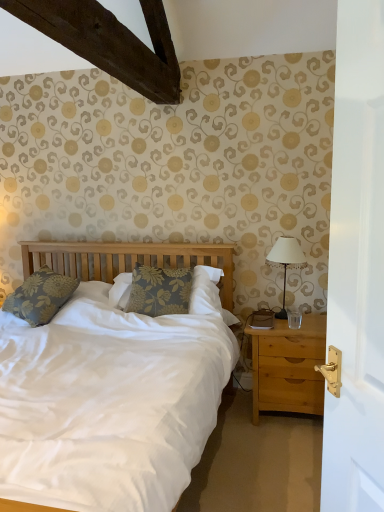
Question: Should I look upward or downward to see floral fabric pillow at center, the 1th pillow from the right?

Choices:
 (A) up
 (B) down

Answer: (B)

Question: From the image's perspective, is floral fabric pillow at left, the second pillow positioned from the right, beneath white fabric-covered lamp at right?

Choices:
 (A) no
 (B) yes

Answer: (B)

Question: Are floral fabric pillow at left, which is counted as the first pillow, starting from the left, and white fabric-covered lamp at right beside each other?

Choices:
 (A) no
 (B) yes

Answer: (A)

Question: Does floral fabric pillow at left, which is counted as the first pillow, starting from the left, come behind white fabric-covered lamp at right?

Choices:
 (A) yes
 (B) no

Answer: (B)

Question: Can you confirm if floral fabric pillow at left, which is counted as the first pillow, starting from the left, is positioned to the right of white fabric-covered lamp at right?

Choices:
 (A) yes
 (B) no

Answer: (B)

Question: Are floral fabric pillow at left, which is counted as the first pillow, starting from the left, and white fabric-covered lamp at right far apart?

Choices:
 (A) yes
 (B) no

Answer: (A)

Question: Is floral fabric pillow at left, the second pillow positioned from the right, not within white fabric-covered lamp at right?

Choices:
 (A) yes
 (B) no

Answer: (A)

Question: Could you tell me if transparent glass at right is turned towards floral fabric pillow at left, the second pillow positioned from the right?

Choices:
 (A) yes
 (B) no

Answer: (B)

Question: Is transparent glass at right at the left side of floral fabric pillow at left, the second pillow positioned from the right?

Choices:
 (A) yes
 (B) no

Answer: (B)

Question: Is transparent glass at right taller than floral fabric pillow at left, which is counted as the first pillow, starting from the left?

Choices:
 (A) no
 (B) yes

Answer: (A)

Question: Is transparent glass at right positioned far away from floral fabric pillow at left, the second pillow positioned from the right?

Choices:
 (A) yes
 (B) no

Answer: (A)

Question: Is transparent glass at right positioned before floral fabric pillow at left, which is counted as the first pillow, starting from the left?

Choices:
 (A) no
 (B) yes

Answer: (A)

Question: From a real-world perspective, is transparent glass at right physically below floral fabric pillow at left, which is counted as the first pillow, starting from the left?

Choices:
 (A) yes
 (B) no

Answer: (A)

Question: From a real-world perspective, is transparent glass at right on top of floral fabric pillow at center, the 1th pillow from the right?

Choices:
 (A) no
 (B) yes

Answer: (A)